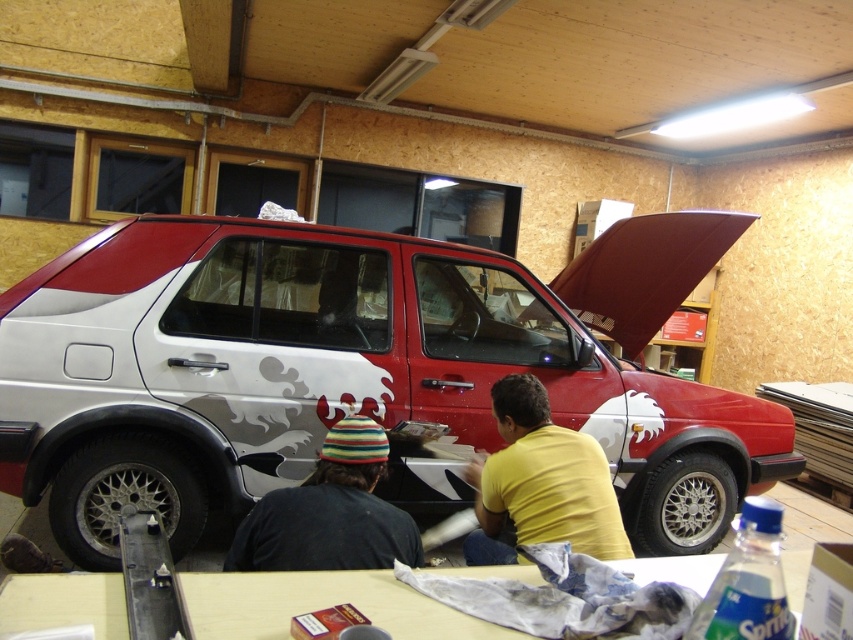
From the picture: Is wooden table at lower center smaller than yellow matte shirt at center?

Indeed, wooden table at lower center has a smaller size compared to yellow matte shirt at center.

Who is positioned more to the left, wooden table at lower center or yellow matte shirt at center?

wooden table at lower center

Identify the location of wooden table at lower center. This screenshot has width=853, height=640. (321, 605).

The width and height of the screenshot is (853, 640). Find the location of `wooden table at lower center`. wooden table at lower center is located at coordinates (321, 605).

Does point (602, 520) come in front of point (381, 512)?

That is False.

Which is below, yellow matte shirt at center or striped knit hat at lower center?

yellow matte shirt at center is below.

Which is behind, point (509, 552) or point (421, 556)?

Point (509, 552)

I want to click on yellow matte shirt at center, so click(x=541, y=483).

Can you confirm if metallic silver car at center is positioned above yellow matte shirt at center?

Yes.

Does metallic silver car at center have a greater width compared to yellow matte shirt at center?

Indeed, metallic silver car at center has a greater width compared to yellow matte shirt at center.

You are a GUI agent. You are given a task and a screenshot of the screen. Output one action in this format:
    pyautogui.click(x=<x>, y=<y>)
    Task: Click on the metallic silver car at center
    
    Given the screenshot: What is the action you would take?
    pyautogui.click(x=354, y=369)